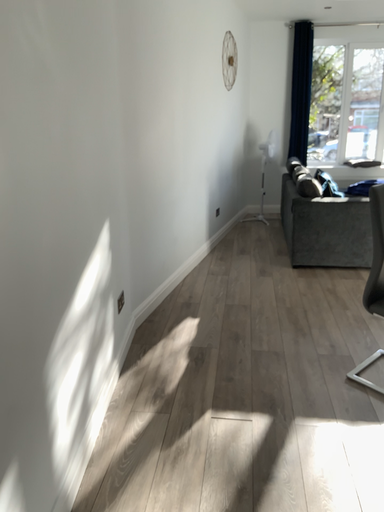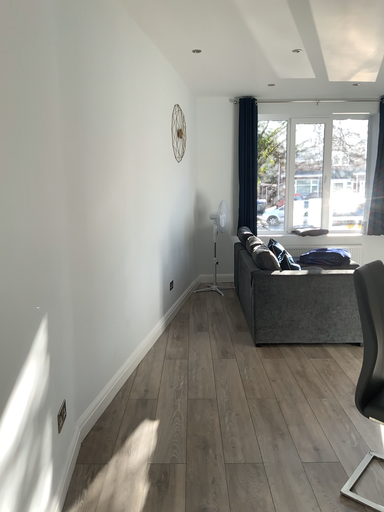
Question: Which way did the camera rotate in the video?

Choices:
 (A) rotated right
 (B) rotated left

Answer: (A)